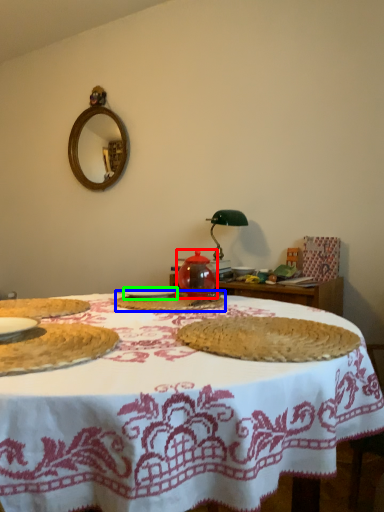
Question: Considering the real-world distances, which object is closest to tea pot (highlighted by a red box)? food (highlighted by a blue box) or tableware (highlighted by a green box).

Choices:
 (A) food
 (B) tableware

Answer: (A)